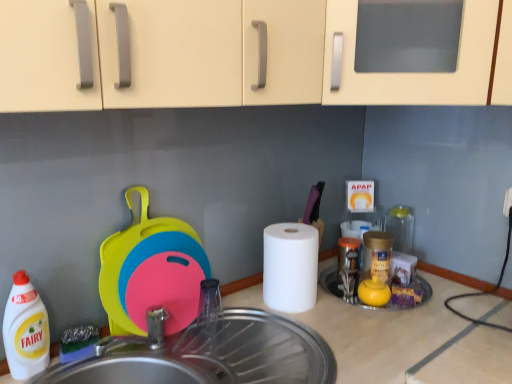
Question: Is white matte paper towel at center to the left or to the right of metallic stainless steel sink at lower center in the image?

Choices:
 (A) right
 (B) left

Answer: (A)

Question: Looking at their shapes, would you say white matte paper towel at center is wider or thinner than metallic stainless steel sink at lower center?

Choices:
 (A) thin
 (B) wide

Answer: (A)

Question: Which is nearer to the metallic stainless steel sink at lower center?

Choices:
 (A) white plastic bottle at left
 (B) white matte paper towel at center
 (C) rubberized plastic cutting boards at left

Answer: (C)

Question: Which of these objects is positioned closest to the metallic stainless steel sink at lower center?

Choices:
 (A) white plastic bottle at left
 (B) rubberized plastic cutting boards at left
 (C) white matte paper towel at center

Answer: (B)